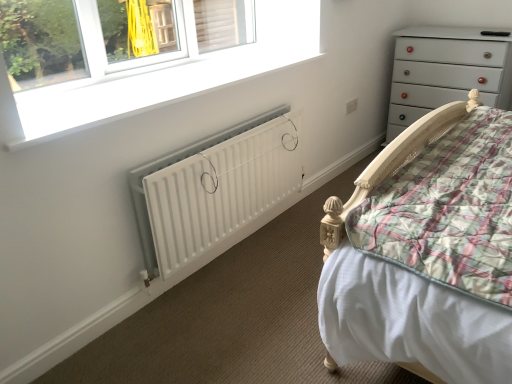
Question: Is white matte radiator at lower center completely or partially inside white matte window at upper left?

Choices:
 (A) yes
 (B) no

Answer: (B)

Question: Does white matte window at upper left have a greater width compared to white matte radiator at lower center?

Choices:
 (A) yes
 (B) no

Answer: (A)

Question: Is white matte window at upper left positioned behind white matte radiator at lower center?

Choices:
 (A) no
 (B) yes

Answer: (A)

Question: Does white matte window at upper left have a greater height compared to white matte radiator at lower center?

Choices:
 (A) yes
 (B) no

Answer: (B)

Question: Can you confirm if white matte window at upper left is bigger than white matte radiator at lower center?

Choices:
 (A) no
 (B) yes

Answer: (A)

Question: From their relative heights in the image, would you say white matte radiator at lower center is taller or shorter than white glossy chest of drawers at upper right?

Choices:
 (A) short
 (B) tall

Answer: (A)

Question: From the image's perspective, is white matte radiator at lower center located above or below white glossy chest of drawers at upper right?

Choices:
 (A) above
 (B) below

Answer: (B)

Question: From a real-world perspective, relative to white glossy chest of drawers at upper right, is white matte radiator at lower center vertically above or below?

Choices:
 (A) above
 (B) below

Answer: (B)

Question: Would you say white matte radiator at lower center is to the left or to the right of white glossy chest of drawers at upper right in the picture?

Choices:
 (A) right
 (B) left

Answer: (B)

Question: Considering their positions, is white glossy chest of drawers at upper right located in front of or behind white matte radiator at lower center?

Choices:
 (A) behind
 (B) front

Answer: (A)

Question: Looking at their shapes, would you say white glossy chest of drawers at upper right is wider or thinner than white matte radiator at lower center?

Choices:
 (A) thin
 (B) wide

Answer: (B)

Question: Is point (418, 36) positioned closer to the camera than point (175, 168)?

Choices:
 (A) closer
 (B) farther

Answer: (B)

Question: From a real-world perspective, is white glossy chest of drawers at upper right physically located above or below white matte radiator at lower center?

Choices:
 (A) below
 (B) above

Answer: (B)

Question: Visually, is white matte window at upper left positioned to the left or to the right of white matte radiator at lower center?

Choices:
 (A) left
 (B) right

Answer: (A)

Question: Considering their positions, is white matte window at upper left located in front of or behind white matte radiator at lower center?

Choices:
 (A) front
 (B) behind

Answer: (A)